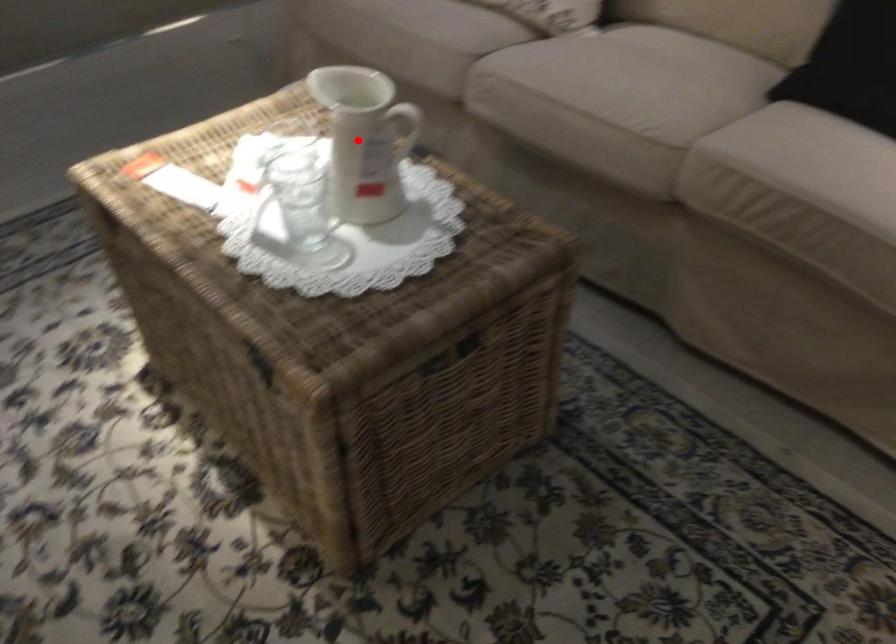
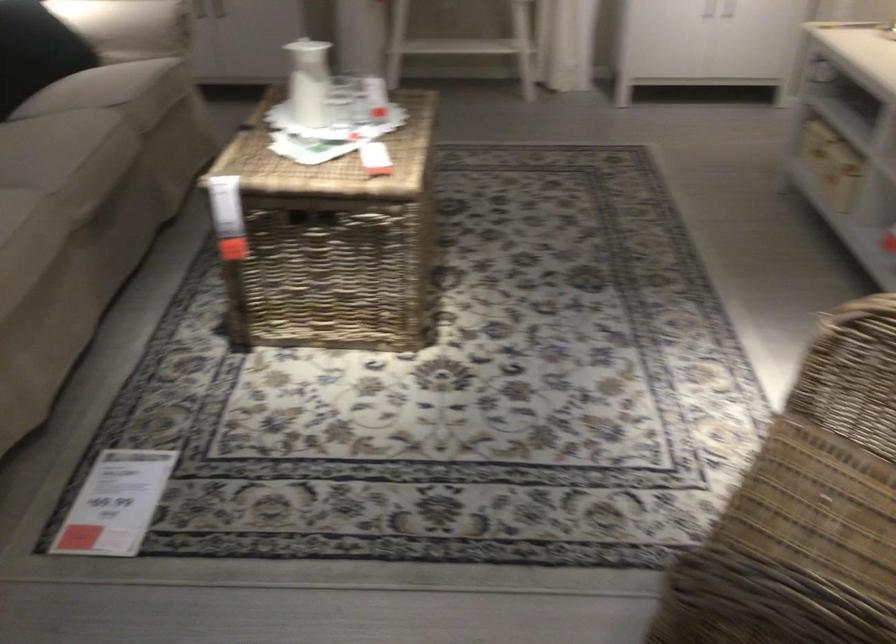
Question: I am providing you with two images of the same scene from different viewpoints. Image1 has a red point marked. In image2, the corresponding 3D location appears at what relative position? Reply with the corresponding letter.

Choices:
 (A) Closer
 (B) Farther

Answer: (B)